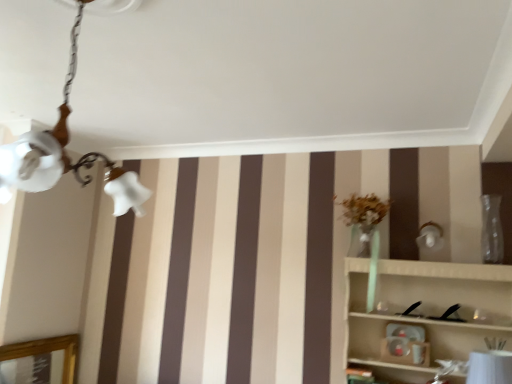
Question: Is white frosted glass chandelier at upper left touching transparent glass vase at right?

Choices:
 (A) no
 (B) yes

Answer: (A)

Question: Does white frosted glass chandelier at upper left have a larger size compared to transparent glass vase at right?

Choices:
 (A) no
 (B) yes

Answer: (B)

Question: Can you confirm if white frosted glass chandelier at upper left is shorter than transparent glass vase at right?

Choices:
 (A) no
 (B) yes

Answer: (A)

Question: From a real-world perspective, is white frosted glass chandelier at upper left located beneath transparent glass vase at right?

Choices:
 (A) no
 (B) yes

Answer: (A)

Question: From a real-world perspective, is white frosted glass chandelier at upper left located higher than transparent glass vase at right?

Choices:
 (A) no
 (B) yes

Answer: (B)

Question: Would you say white frosted glass chandelier at upper left contains transparent glass vase at right?

Choices:
 (A) yes
 (B) no

Answer: (B)

Question: Considering the relative positions of white frosted glass chandelier at upper left and white glossy table lamp at lower right in the image provided, is white frosted glass chandelier at upper left behind white glossy table lamp at lower right?

Choices:
 (A) no
 (B) yes

Answer: (A)

Question: Considering the relative sizes of white frosted glass chandelier at upper left and white glossy table lamp at lower right in the image provided, is white frosted glass chandelier at upper left wider than white glossy table lamp at lower right?

Choices:
 (A) no
 (B) yes

Answer: (B)

Question: Can you confirm if white frosted glass chandelier at upper left is taller than white glossy table lamp at lower right?

Choices:
 (A) no
 (B) yes

Answer: (B)

Question: Is white frosted glass chandelier at upper left located outside white glossy table lamp at lower right?

Choices:
 (A) no
 (B) yes

Answer: (B)

Question: Does white frosted glass chandelier at upper left have a lesser height compared to white glossy table lamp at lower right?

Choices:
 (A) no
 (B) yes

Answer: (A)

Question: From the image's perspective, does white frosted glass chandelier at upper left appear higher than white glossy table lamp at lower right?

Choices:
 (A) yes
 (B) no

Answer: (A)

Question: Is white glossy table lamp at lower right in front of white frosted glass chandelier at upper left?

Choices:
 (A) no
 (B) yes

Answer: (A)